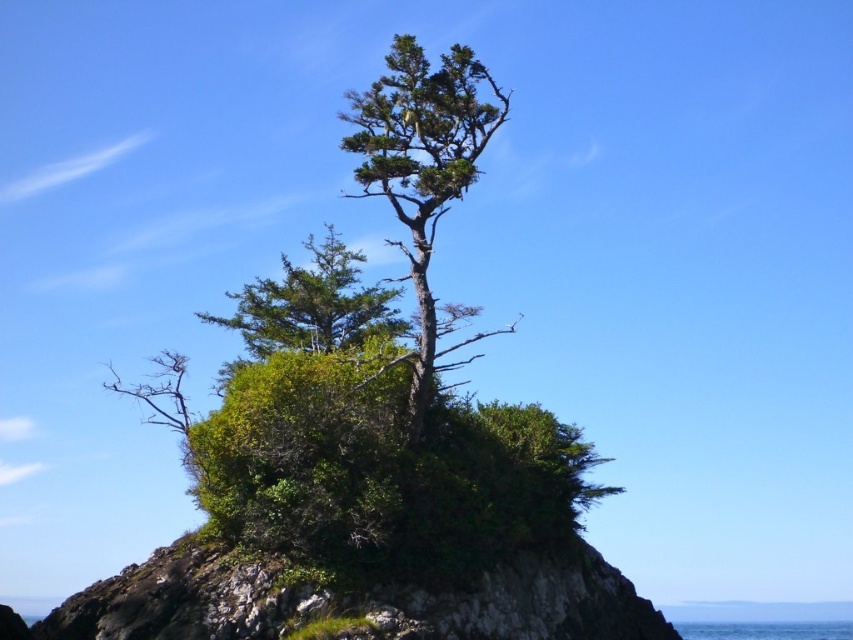
Question: Which point is closer to the camera?

Choices:
 (A) (473, 308)
 (B) (753, 637)

Answer: (A)

Question: Which point is closer to the camera taking this photo?

Choices:
 (A) (425, 328)
 (B) (793, 627)

Answer: (A)

Question: Does green textured tree at center lie behind blue liquid water at lower center?

Choices:
 (A) no
 (B) yes

Answer: (A)

Question: Among these points, which one is farthest from the camera?

Choices:
 (A) (699, 637)
 (B) (422, 282)

Answer: (A)

Question: Does green textured tree at center have a greater width compared to blue liquid water at lower center?

Choices:
 (A) yes
 (B) no

Answer: (B)

Question: Is green textured tree at center in front of blue liquid water at lower center?

Choices:
 (A) yes
 (B) no

Answer: (A)